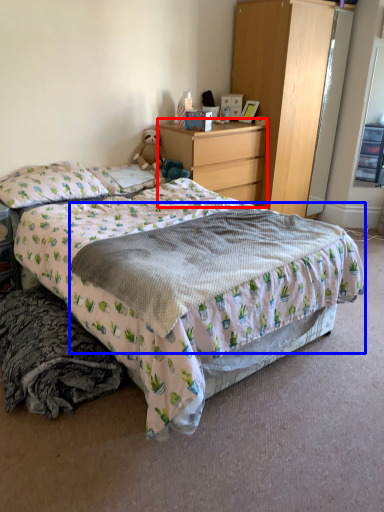
Question: Which object is further to the camera taking this photo, desk (highlighted by a red box) or blanket (highlighted by a blue box)?

Choices:
 (A) desk
 (B) blanket

Answer: (A)